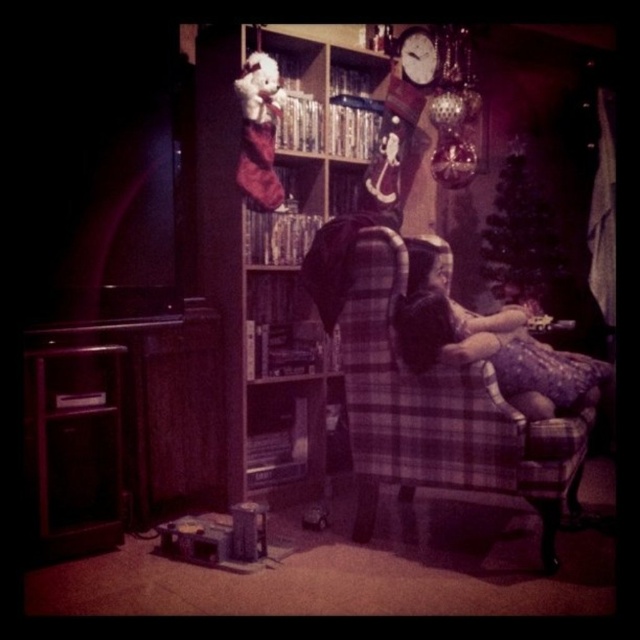
You are a parent trying to decide whether to place a new floor lamp next to the plaid fabric armchair at center and the matte purple dress at center. The lamp requires 1 meter of space between it and any furniture. Given their heights, can you determine if the lamp will fit without obstructing the view of the dress?

The plaid fabric armchair at center is taller than the matte purple dress at center. Since the lamp requires 1 meter of space between it and any furniture, you need to ensure there is enough horizontal space. However, the height difference does not affect the lamp placement. Check the horizontal distance between the armchair and dress to confirm if 1 meter is available.

You are standing in the room and want to sit down on the plaid fabric armchair at center. According to the coordinates provided, where should you walk to in the room?

The plaid fabric armchair at center is located at coordinates point (438, 404), so you should walk towards that point to sit down on it.